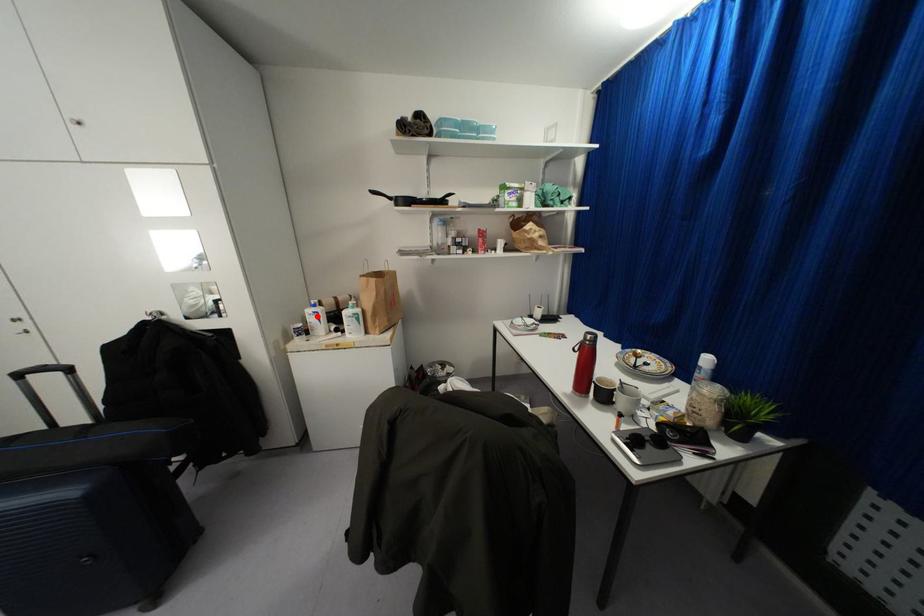
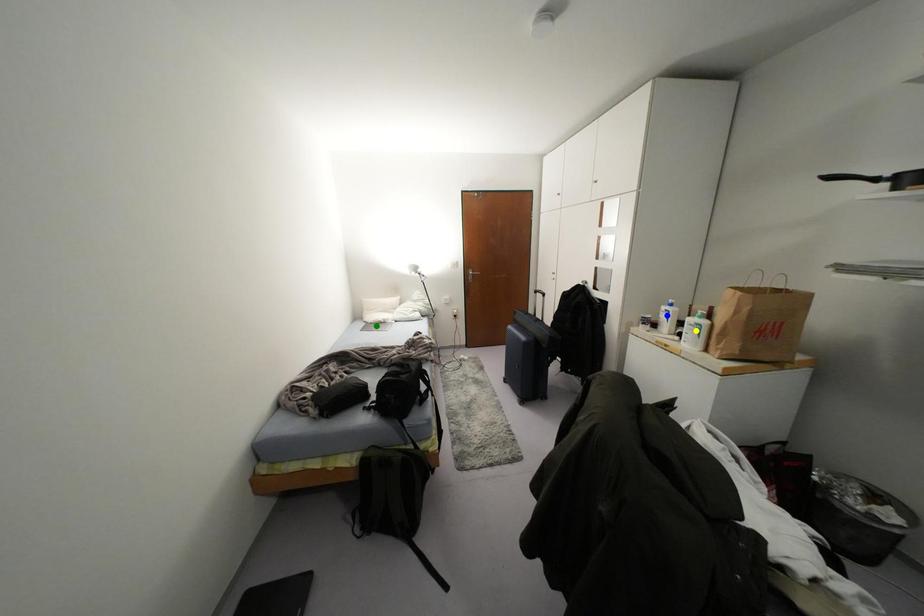
Question: I am providing you with two images of the same scene from different viewpoints. A red point is marked on the first image. You are given multiple points on the second image. Which point in image 2 represents the same 3d spot as the red point in image 1?

Choices:
 (A) green point
 (B) blue point
 (C) yellow point

Answer: (B)